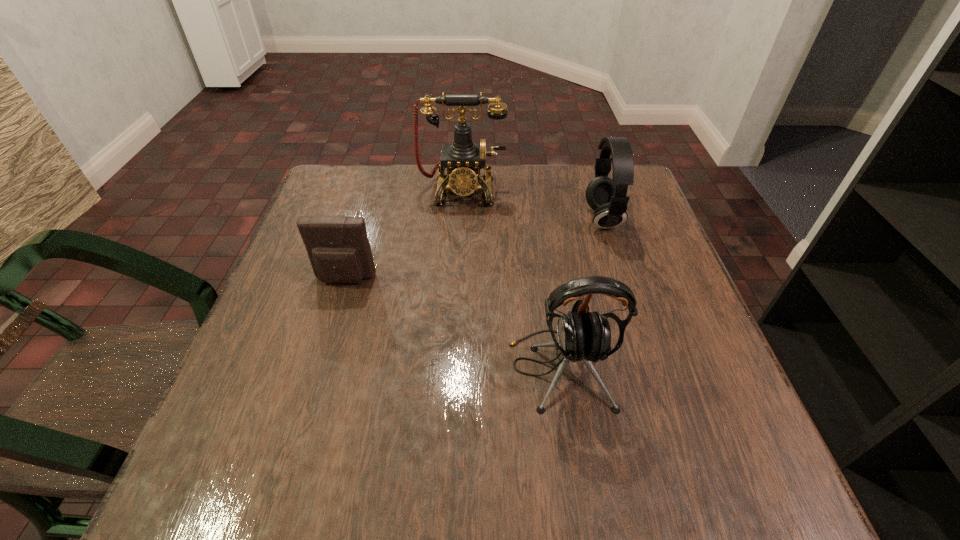
This screenshot has height=540, width=960. What are the coordinates of `vacant area that lies between the telephone and the rightmost object` in the screenshot? It's located at 532,204.

Find the location of `blank region between the shorter earphone and the shortest object`. blank region between the shorter earphone and the shortest object is located at coordinates (473, 249).

I want to click on vacant space that is in between the third farthest object and the shorter earphone, so click(473, 249).

Point out which object is positioned as the nearest to the second nearest object. Please provide its 2D coordinates. Your answer should be formatted as a tuple, i.e. [(x, y)], where the tuple contains the x and y coordinates of a point satisfying the conditions above.

[(463, 159)]

Find the location of `the third closest object to the nearer earphone`. the third closest object to the nearer earphone is located at coordinates (463, 159).

Find the location of `vacant space that satisfies the following two spatial constraints: 1. on the ear cups of the second shortest object; 2. with an open flap on the pouch`. vacant space that satisfies the following two spatial constraints: 1. on the ear cups of the second shortest object; 2. with an open flap on the pouch is located at coordinates (622, 280).

This screenshot has height=540, width=960. In order to click on free space that satisfies the following two spatial constraints: 1. on the front of the nearer earphone, featuring the rotary dial; 2. on the left side of the telephone in this screenshot , I will do `click(452, 369)`.

The image size is (960, 540). Find the location of `free spot that satisfies the following two spatial constraints: 1. on the ear cups of the rightmost object; 2. with an open flap on the leftmost object`. free spot that satisfies the following two spatial constraints: 1. on the ear cups of the rightmost object; 2. with an open flap on the leftmost object is located at coordinates (622, 280).

The width and height of the screenshot is (960, 540). Find the location of `vacant space that satisfies the following two spatial constraints: 1. with an open flap on the leftmost object; 2. on the right side of the taller earphone`. vacant space that satisfies the following two spatial constraints: 1. with an open flap on the leftmost object; 2. on the right side of the taller earphone is located at coordinates (318, 369).

Where is `free space that satisfies the following two spatial constraints: 1. on the ear cups of the farther earphone; 2. with an open flap on the third farthest object`? This screenshot has width=960, height=540. free space that satisfies the following two spatial constraints: 1. on the ear cups of the farther earphone; 2. with an open flap on the third farthest object is located at coordinates (622, 280).